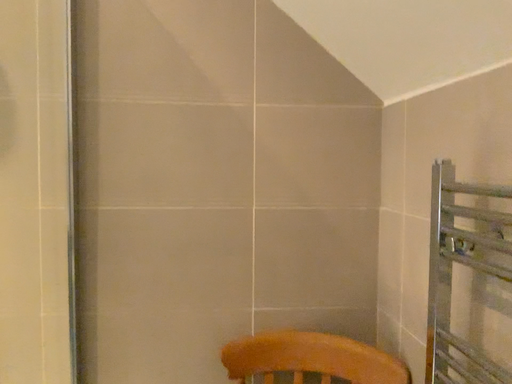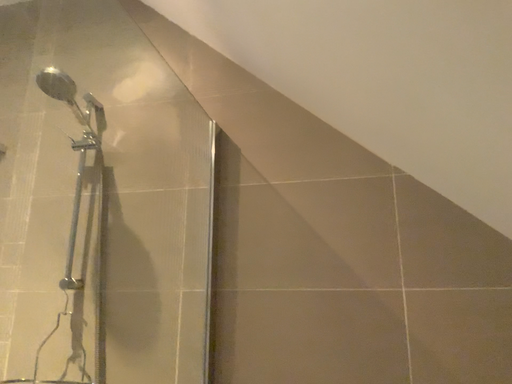
Question: How did the camera likely rotate when shooting the video?

Choices:
 (A) rotated right
 (B) rotated left

Answer: (B)